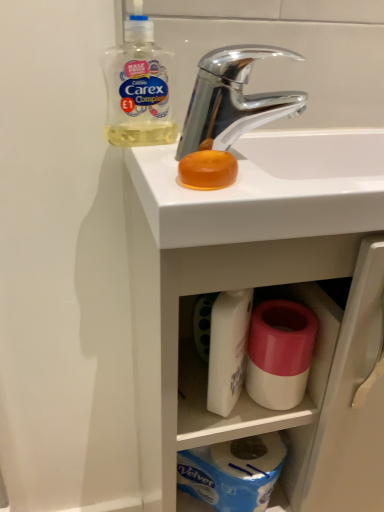
Question: Considering the positions of translucent plastic bottle at upper left and pink matte toilet paper at lower center in the image, is translucent plastic bottle at upper left bigger or smaller than pink matte toilet paper at lower center?

Choices:
 (A) small
 (B) big

Answer: (B)

Question: Based on their positions, is translucent plastic bottle at upper left located to the left or right of pink matte toilet paper at lower center?

Choices:
 (A) left
 (B) right

Answer: (A)

Question: Estimate the real-world distances between objects in this image. Which object is farther from the white glossy sink at upper center?

Choices:
 (A) chrome metallic faucet at upper center
 (B) translucent plastic bottle at upper left
 (C) pink matte toilet paper at lower center
 (D) white plastic container at center

Answer: (B)

Question: Estimate the real-world distances between objects in this image. Which object is farther from the chrome metallic faucet at upper center?

Choices:
 (A) pink matte toilet paper at lower center
 (B) translucent plastic bottle at upper left
 (C) white plastic container at center
 (D) white glossy sink at upper center

Answer: (C)